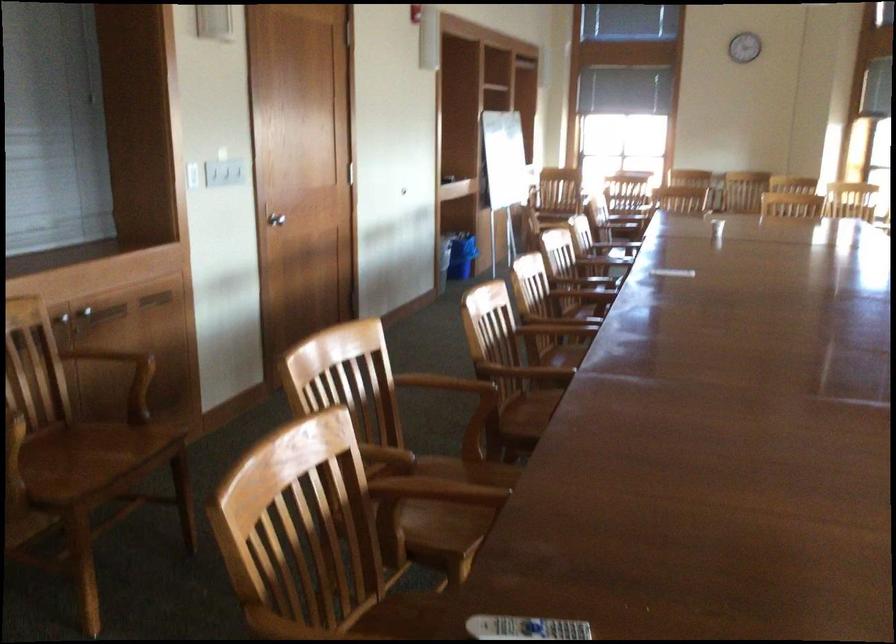
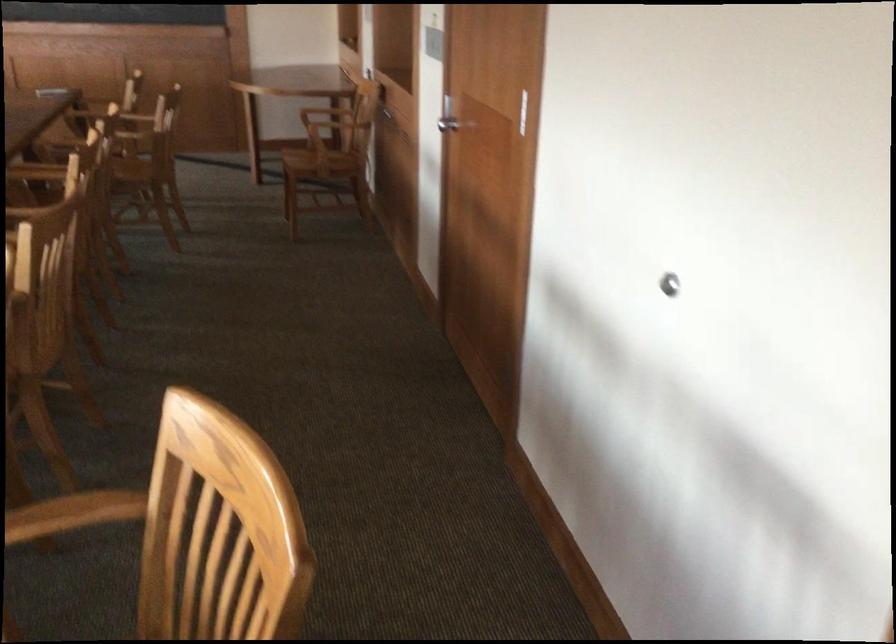
Question: I am providing you with two images of the same scene from different viewpoints. Which of the following objects are not visible in image2?

Choices:
 (A) wooden chair sitting surface
 (B) silver door handle
 (C) chair sitting surface
 (D) red-capped marker

Answer: (A)